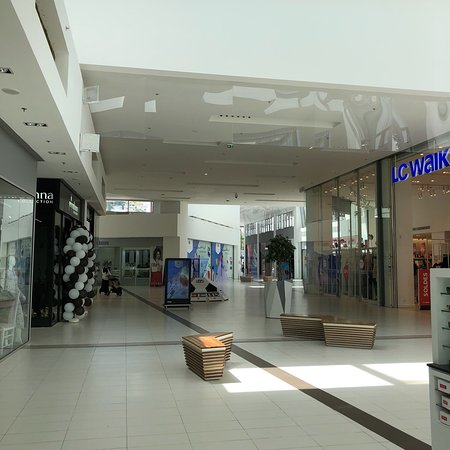
At what (x,y) coordinates should I click in order to perform the action: click on exit doors. Please return your answer as a coordinate pair (x, y). The width and height of the screenshot is (450, 450). Looking at the image, I should click on (139, 271), (126, 271).